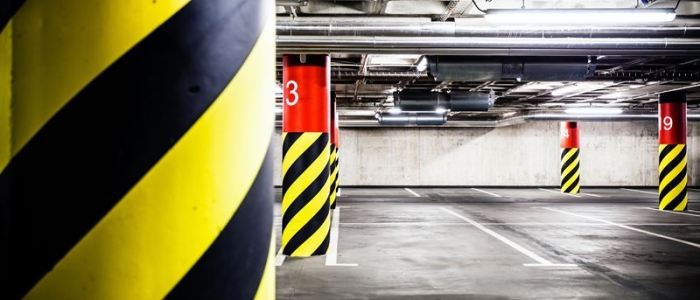
Where is `pillar`? This screenshot has width=700, height=300. pillar is located at coordinates (155, 115), (302, 178), (332, 173), (337, 164), (568, 166), (672, 168).